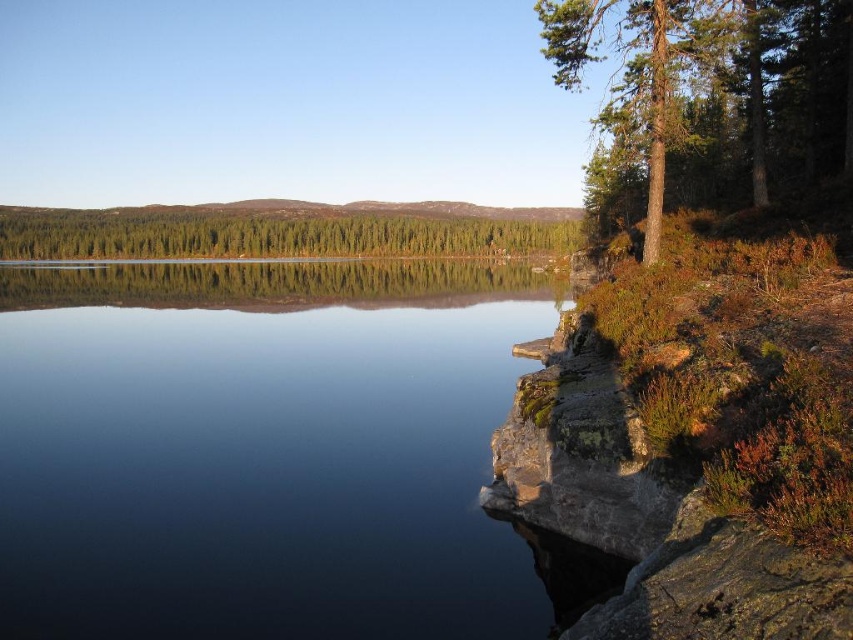
Question: Can you confirm if transparent glass water at center is wider than green matte trees at center?

Choices:
 (A) no
 (B) yes

Answer: (A)

Question: Among these points, which one is nearest to the camera?

Choices:
 (A) (10, 520)
 (B) (738, 44)

Answer: (A)

Question: Considering the real-world distances, which object is closest to the green matte trees at center?

Choices:
 (A) green textured tree at upper right
 (B) transparent glass water at center

Answer: (B)

Question: Does transparent glass water at center have a smaller size compared to green matte trees at center?

Choices:
 (A) no
 (B) yes

Answer: (B)

Question: Estimate the real-world distances between objects in this image. Which object is farther from the green matte trees at center?

Choices:
 (A) transparent glass water at center
 (B) green textured tree at upper right

Answer: (B)

Question: Does transparent glass water at center appear on the right side of green matte trees at center?

Choices:
 (A) no
 (B) yes

Answer: (B)